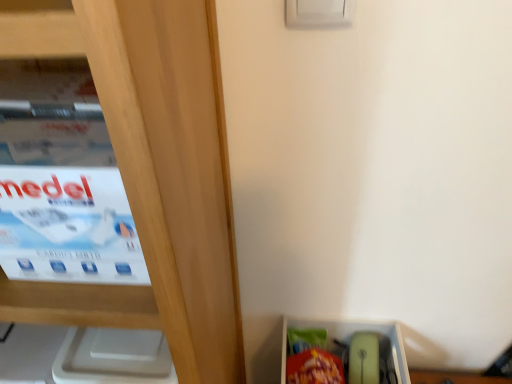
Question: Is white cardboard box at left completely or partially outside of matte plastic storage box at lower right?

Choices:
 (A) yes
 (B) no

Answer: (A)

Question: From a real-world perspective, is white cardboard box at left physically below matte plastic storage box at lower right?

Choices:
 (A) no
 (B) yes

Answer: (A)

Question: Is white cardboard box at left far away from matte plastic storage box at lower right?

Choices:
 (A) yes
 (B) no

Answer: (B)

Question: Are white cardboard box at left and matte plastic storage box at lower right making contact?

Choices:
 (A) no
 (B) yes

Answer: (A)

Question: Can you confirm if white cardboard box at left is thinner than matte plastic storage box at lower right?

Choices:
 (A) yes
 (B) no

Answer: (A)

Question: Is white cardboard box at left taller than matte plastic storage box at lower right?

Choices:
 (A) yes
 (B) no

Answer: (A)

Question: Does matte plastic storage box at lower right have a greater width compared to white cardboard box at left?

Choices:
 (A) no
 (B) yes

Answer: (B)

Question: Considering the relative sizes of matte plastic storage box at lower right and white cardboard box at left in the image provided, is matte plastic storage box at lower right shorter than white cardboard box at left?

Choices:
 (A) no
 (B) yes

Answer: (B)

Question: Would you say matte plastic storage box at lower right is a long distance from white cardboard box at left?

Choices:
 (A) no
 (B) yes

Answer: (A)

Question: From the image's perspective, is matte plastic storage box at lower right over white cardboard box at left?

Choices:
 (A) no
 (B) yes

Answer: (A)

Question: Could you tell me if matte plastic storage box at lower right is facing white cardboard box at left?

Choices:
 (A) no
 (B) yes

Answer: (A)

Question: Is matte plastic storage box at lower right located outside white cardboard box at left?

Choices:
 (A) no
 (B) yes

Answer: (B)

Question: In terms of width, does white cardboard box at left look wider or thinner when compared to matte plastic storage box at lower right?

Choices:
 (A) thin
 (B) wide

Answer: (A)